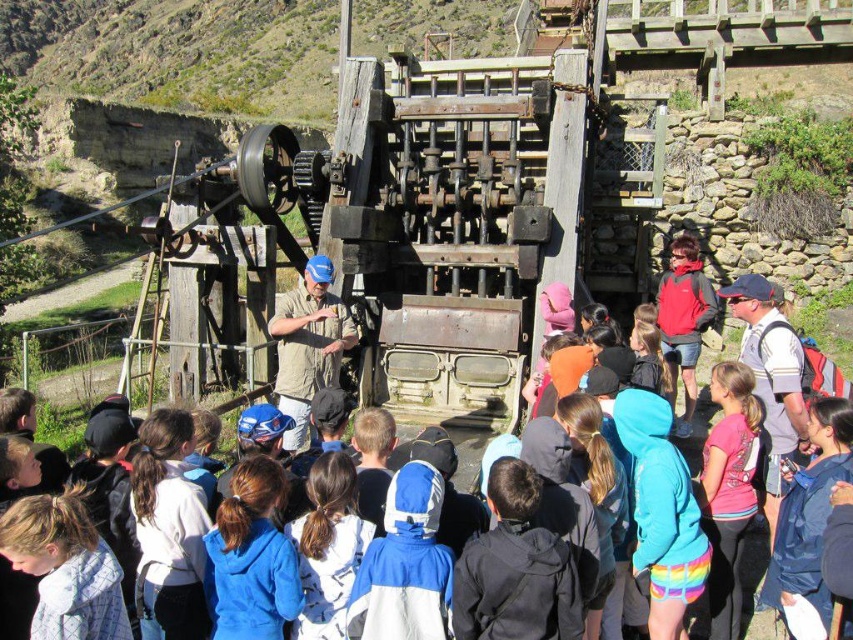
Can you confirm if blue fleece jacket at lower center is positioned above white fabric at center?

No.

Who is more distant from viewer, (x=271, y=589) or (x=309, y=518)?

Positioned behind is point (x=309, y=518).

The width and height of the screenshot is (853, 640). What are the coordinates of `blue fleece jacket at lower center` in the screenshot? It's located at (250, 557).

Can you confirm if blue fleece jacket at lower center is smaller than pink fabric shirt at center?

Correct, blue fleece jacket at lower center occupies less space than pink fabric shirt at center.

Can you confirm if blue fleece jacket at lower center is positioned to the left of pink fabric shirt at center?

Yes, blue fleece jacket at lower center is to the left of pink fabric shirt at center.

Does point (228, 547) come farther from viewer compared to point (712, 500)?

That is False.

Find the location of a particular element. This screenshot has height=640, width=853. blue fleece jacket at lower center is located at coordinates (250, 557).

Does pink fabric shirt at center have a larger size compared to white fabric at center?

Correct, pink fabric shirt at center is larger in size than white fabric at center.

Can you confirm if pink fabric shirt at center is wider than white fabric at center?

Indeed, pink fabric shirt at center has a greater width compared to white fabric at center.

What do you see at coordinates (729, 490) in the screenshot? The height and width of the screenshot is (640, 853). I see `pink fabric shirt at center` at bounding box center [729, 490].

The height and width of the screenshot is (640, 853). Find the location of `pink fabric shirt at center`. pink fabric shirt at center is located at coordinates (729, 490).